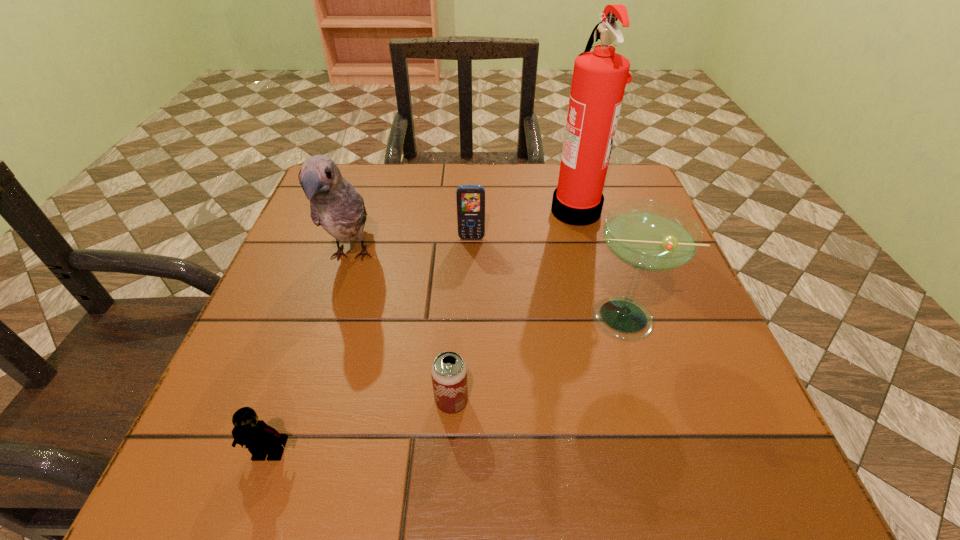
Locate an element on the screen. The height and width of the screenshot is (540, 960). vacant space located 0.100m on the back of the martini is located at coordinates (600, 256).

Image resolution: width=960 pixels, height=540 pixels. What are the coordinates of `free spot located 0.400m on the screen of the fourth tallest object` in the screenshot? It's located at (468, 402).

Identify the location of free region located on the right of the second nearest object. (619, 401).

I want to click on object located at the far edge, so click(599, 79).

Find the location of a particular element. The width and height of the screenshot is (960, 540). object at the near edge is located at coordinates (261, 439).

At what (x,y) coordinates should I click in order to perform the action: click on parrot that is at the left edge. Please return your answer as a coordinate pair (x, y). Looking at the image, I should click on (334, 203).

Find the location of a particular element. Lego that is at the left edge is located at coordinates (261, 439).

Locate an element on the screen. The width and height of the screenshot is (960, 540). fire extinguisher located in the right edge section of the desktop is located at coordinates (599, 79).

Where is `martini situated at the right edge`? This screenshot has height=540, width=960. martini situated at the right edge is located at coordinates (647, 235).

I want to click on object situated at the near left corner, so click(x=261, y=439).